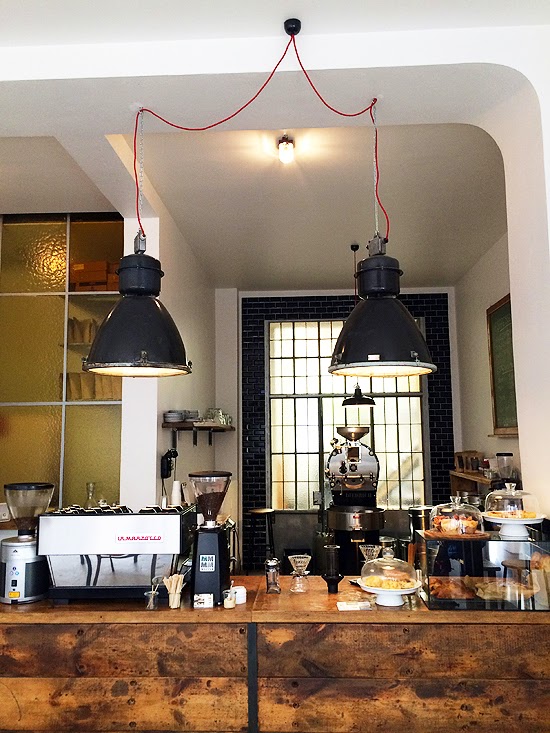
This screenshot has width=550, height=733. Find the location of `blurry window`. blurry window is located at coordinates (51, 356), (33, 270), (34, 430), (82, 446).